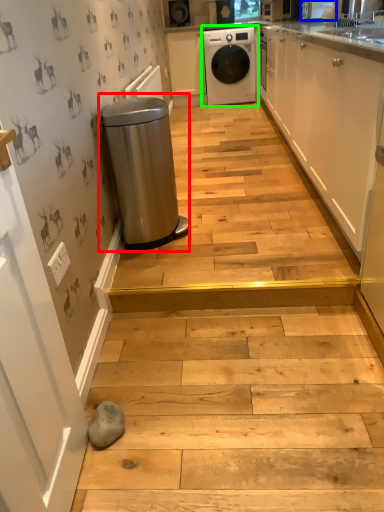
Question: Which object is positioned farthest from waste container (highlighted by a red box)? Select from appliance (highlighted by a blue box) and home appliance (highlighted by a green box).

Choices:
 (A) appliance
 (B) home appliance

Answer: (B)